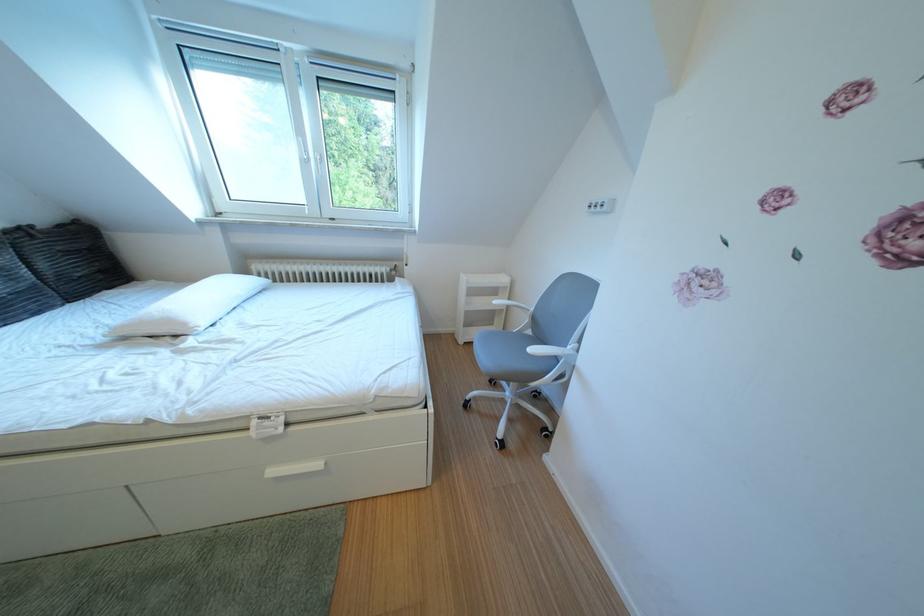
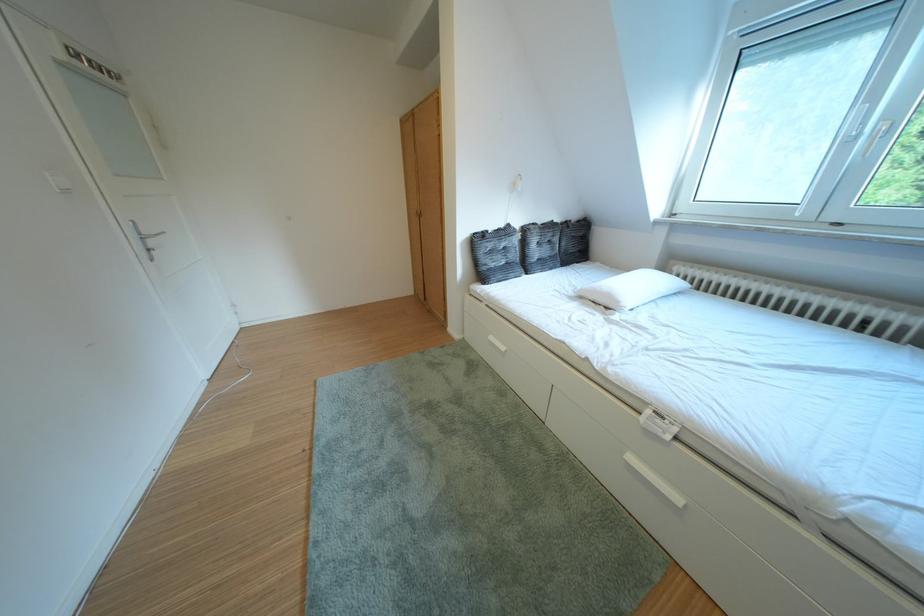
Locate, in the second image, the point that corresponds to point 184,326 in the first image.

(623, 301)